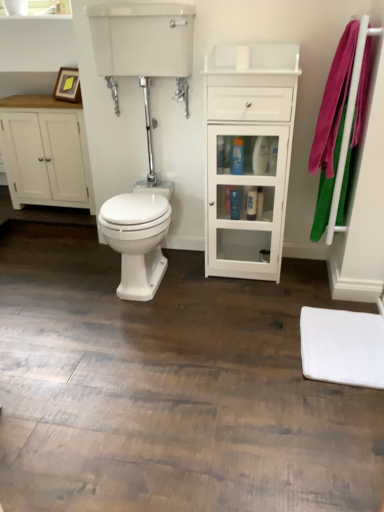
You are a GUI agent. You are given a task and a screenshot of the screen. Output one action in this format:
    pyautogui.click(x=<x>, y=<y>)
    Task: Click on the vacant area that is situated to the right of white glossy cabinet at center
    
    Given the screenshot: What is the action you would take?
    pyautogui.click(x=301, y=276)